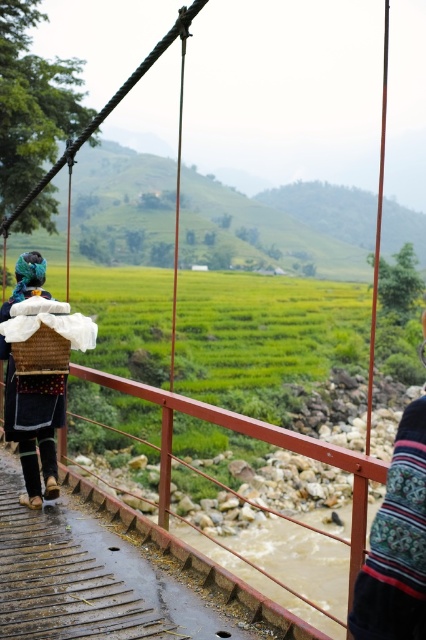
Question: Which object is positioned farthest from the striped fabric shawl at center?

Choices:
 (A) rustic woven basket at left
 (B) dark blue woven basket at left

Answer: (B)

Question: Considering the real-world distances, which object is farthest from the dark blue woven basket at left?

Choices:
 (A) rustic woven basket at left
 (B) striped fabric shawl at center

Answer: (B)

Question: Can you confirm if striped fabric shawl at center is positioned to the right of dark blue woven basket at left?

Choices:
 (A) no
 (B) yes

Answer: (B)

Question: Among these objects, which one is nearest to the camera?

Choices:
 (A) striped fabric shawl at center
 (B) rustic woven basket at left
 (C) dark blue woven basket at left

Answer: (A)

Question: Can you confirm if dark blue woven basket at left is wider than rustic woven basket at left?

Choices:
 (A) yes
 (B) no

Answer: (A)

Question: Can you confirm if striped fabric shawl at center is thinner than rustic woven basket at left?

Choices:
 (A) yes
 (B) no

Answer: (A)